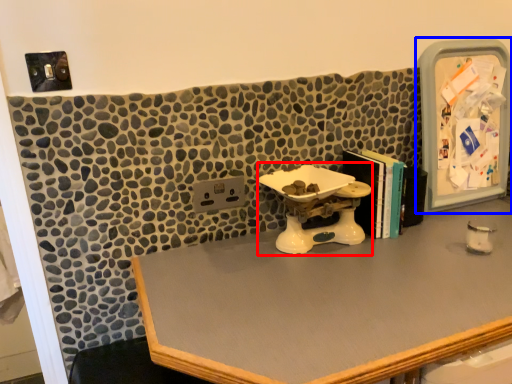
Question: Which point is closer to the camera, sink (highlighted by a red box) or medicine cabinet (highlighted by a blue box)?

Choices:
 (A) sink
 (B) medicine cabinet

Answer: (A)